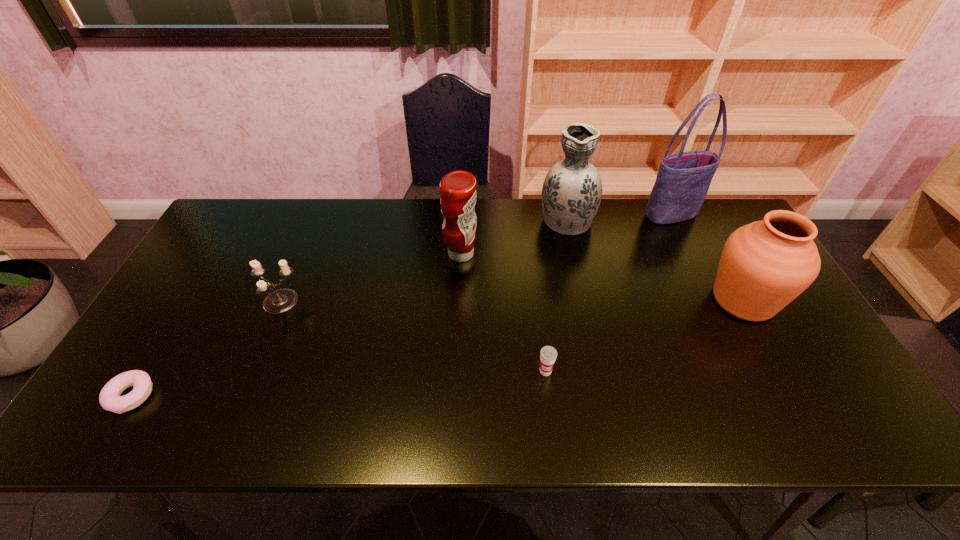
I want to click on condiment located in the far edge section of the desktop, so click(x=458, y=188).

Find the location of a particular element. Image resolution: width=960 pixels, height=540 pixels. object that is at the near edge is located at coordinates (109, 398).

Locate an element on the screen. The height and width of the screenshot is (540, 960). object at the left edge is located at coordinates (109, 398).

Locate an element on the screen. tote bag present at the right edge is located at coordinates (683, 180).

Identify the location of urn that is at the right edge. Image resolution: width=960 pixels, height=540 pixels. (765, 265).

Find the location of `object at the near left corner`. object at the near left corner is located at coordinates (109, 398).

This screenshot has height=540, width=960. Find the location of `object that is at the far right corner`. object that is at the far right corner is located at coordinates coord(683,180).

In order to click on vacant region at the far edge of the desktop in this screenshot , I will do `click(439, 233)`.

Locate an element on the screen. The height and width of the screenshot is (540, 960). vacant point at the near edge is located at coordinates (270, 433).

This screenshot has width=960, height=540. In the image, there is a desktop. Find the location of `vacant space at the left edge`. vacant space at the left edge is located at coordinates (208, 299).